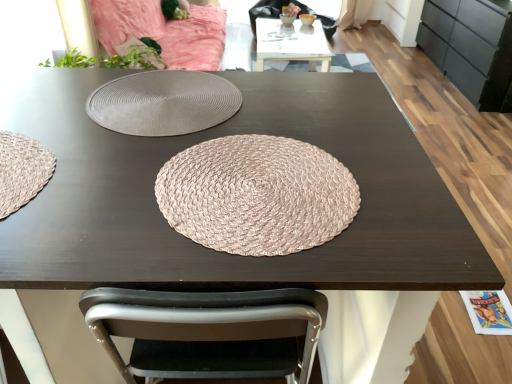
You are a GUI agent. You are given a task and a screenshot of the screen. Output one action in this format:
    pyautogui.click(x=<x>, y=<y>)
    Task: Click on the free point to the left of pink woven mat at center
    
    Given the screenshot: What is the action you would take?
    pyautogui.click(x=95, y=193)